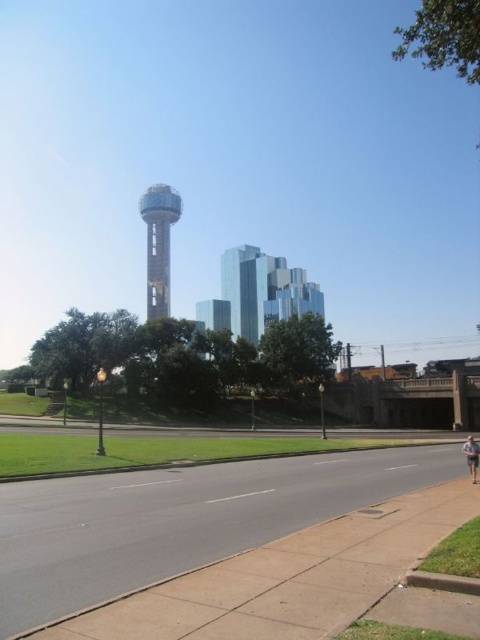
You are standing at the observation tower in the background and want to take a photo of two points in the scene. The first point is labeled as point (253, 586) and the second is point (470, 452). Which point will appear larger in your photo?

Point (253, 586) will appear larger in the photo because it is closer to the camera than point (470, 452).